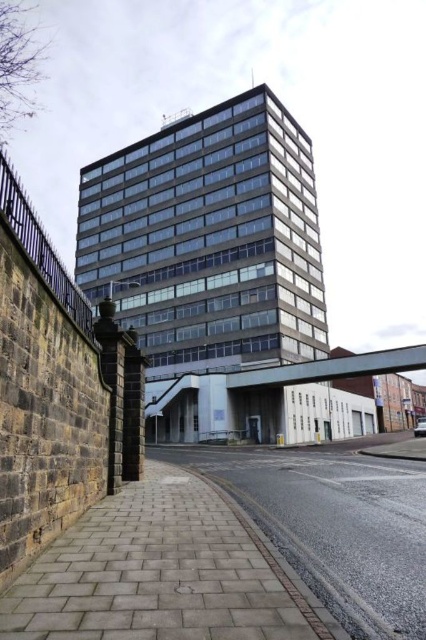
Between gray concrete pavement at lower left and paved brick sidewalk at lower center, which one is positioned higher?

A: gray concrete pavement at lower left is above.

Can you confirm if gray concrete pavement at lower left is taller than paved brick sidewalk at lower center?

Incorrect, gray concrete pavement at lower left's height is not larger of paved brick sidewalk at lower center's.

Locate an element on the screen. This screenshot has width=426, height=640. gray concrete pavement at lower left is located at coordinates (164, 572).